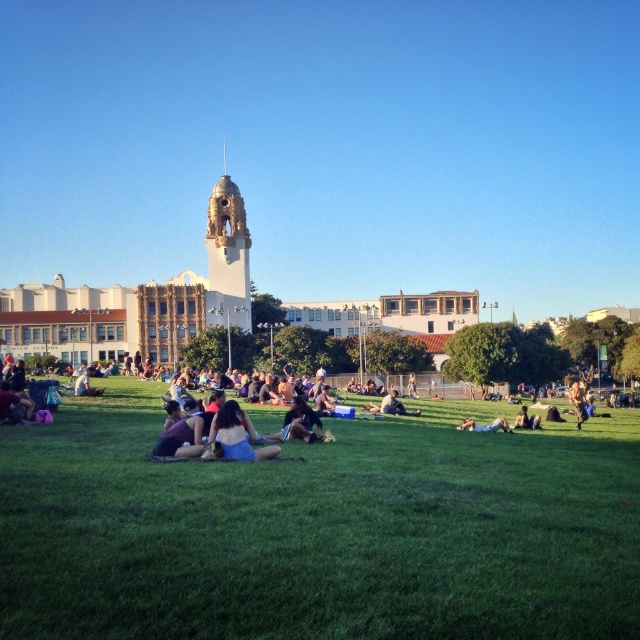
Is the position of matte black jacket at lower left less distant than that of light brown fabric pants at center?

Yes, it is.

Who is more distant from viewer, (10, 417) or (84, 388)?

Point (84, 388)

Find the location of a particular element. Image resolution: width=640 pixels, height=640 pixels. matte black jacket at lower left is located at coordinates (13, 404).

Does gold textured clock tower at center have a greater height compared to matte black jacket at lower left?

Correct, gold textured clock tower at center is much taller as matte black jacket at lower left.

You are a GUI agent. You are given a task and a screenshot of the screen. Output one action in this format:
    pyautogui.click(x=<x>, y=<y>)
    Task: Click on the gold textured clock tower at center
    
    Given the screenshot: What is the action you would take?
    pyautogui.click(x=227, y=253)

What do you see at coordinates (237, 435) in the screenshot?
I see `blue denim shorts at center` at bounding box center [237, 435].

Locate an element on the screen. blue denim shorts at center is located at coordinates pyautogui.click(x=237, y=435).